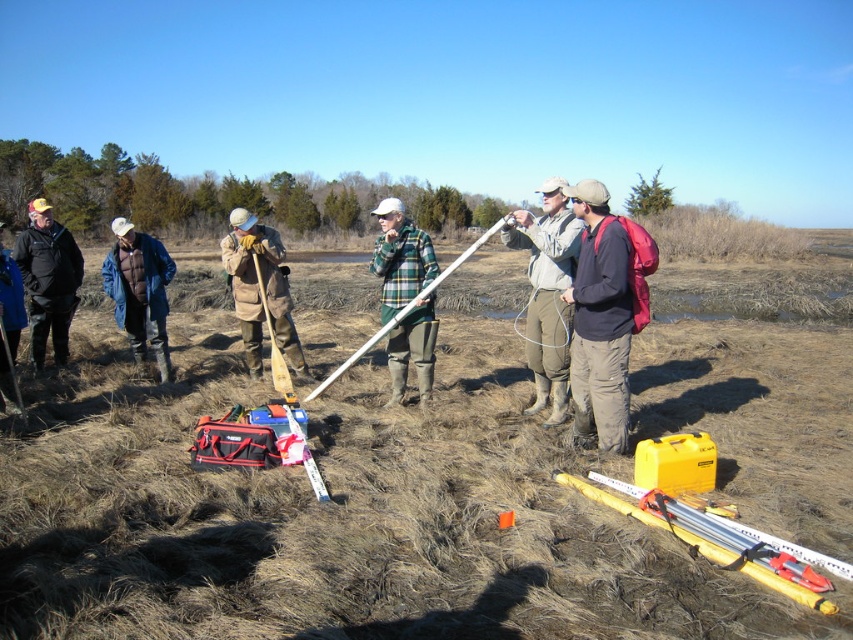
Is brown fuzzy coat at center below matte black tool bag at center?

Incorrect, brown fuzzy coat at center is not positioned below matte black tool bag at center.

Which is in front, point (299, 364) or point (279, 356)?

Point (279, 356) is more forward.

Who is more forward, (242, 292) or (293, 426)?

Positioned in front is point (293, 426).

I want to click on brown fuzzy coat at center, so click(x=259, y=289).

Based on the photo, does matte black jacket at center appear on the right side of matte black tool bag at center?

Indeed, matte black jacket at center is positioned on the right side of matte black tool bag at center.

Which of these two, matte black jacket at center or matte black tool bag at center, stands taller?

matte black jacket at center is taller.

The width and height of the screenshot is (853, 640). I want to click on matte black jacket at center, so click(x=605, y=314).

Find the location of `matte black jacket at center`. matte black jacket at center is located at coordinates (605, 314).

Who is more forward, (543, 273) or (131, 246)?

Positioned in front is point (543, 273).

Which is below, khaki rubber boots at center or blue denim jacket at left?

khaki rubber boots at center

Between point (532, 243) and point (135, 348), which one is positioned in front?

Point (532, 243) is in front.

Find the location of a particular element. khaki rubber boots at center is located at coordinates (547, 292).